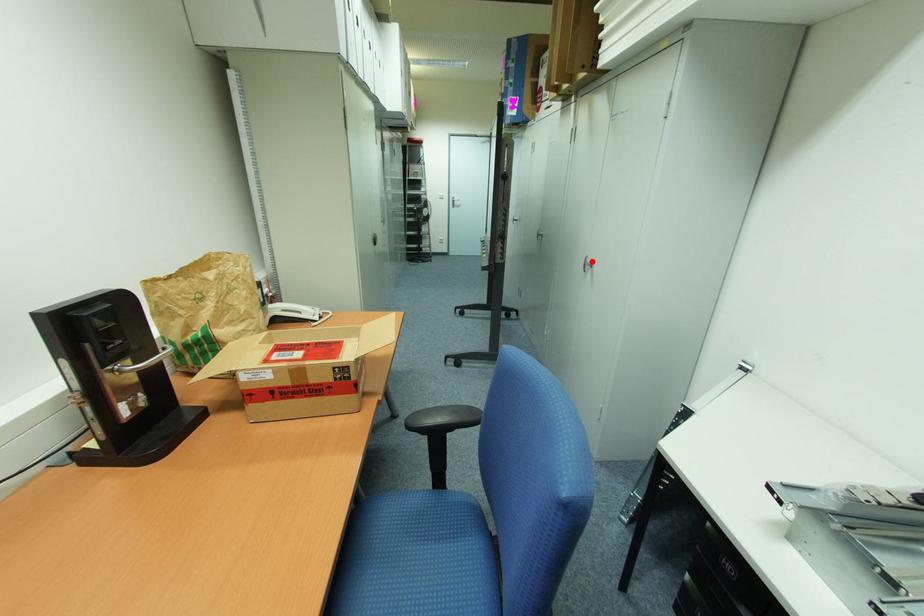
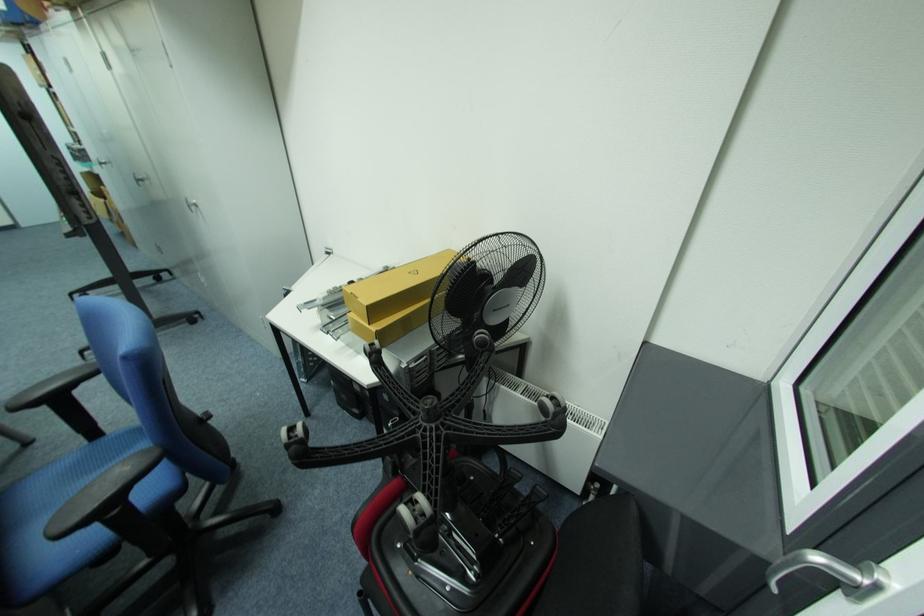
Locate, in the second image, the point that corresponds to the highlighted location in the first image.

(196, 203)